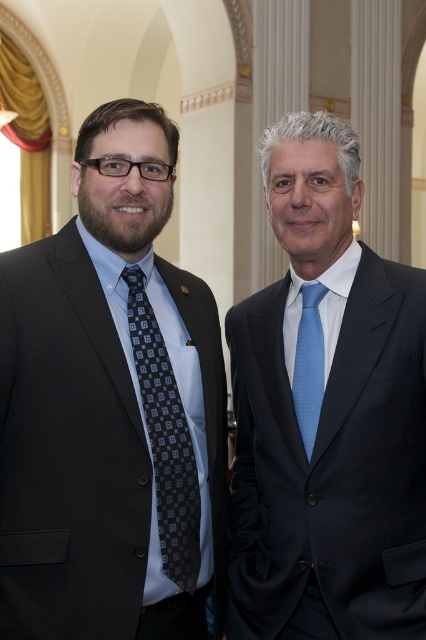
You are a tailor who needs to determine if the matte black suit at left and the matte black suit at center can be stored in a wardrobe with a shelf height of 40 cm. Which suit requires a taller hanger?

The matte black suit at center requires a taller hanger because it is larger than the matte black suit at left according to the description.

What color is the suit worn by the man at point (111, 410)?

The suit at point (111, 410) is matte black.